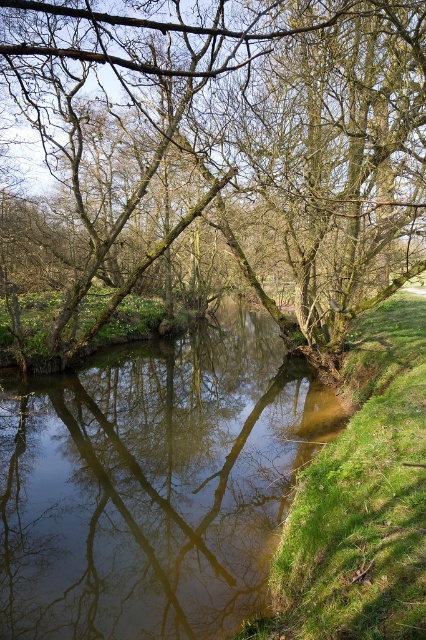
Question: Is smooth bark tree at center further to camera compared to clear water at center?

Choices:
 (A) no
 (B) yes

Answer: (A)

Question: Is smooth bark tree at center positioned behind clear water at center?

Choices:
 (A) yes
 (B) no

Answer: (B)

Question: Which of the following is the farthest from the observer?

Choices:
 (A) smooth bark tree at center
 (B) clear water at center

Answer: (B)

Question: Among these objects, which one is nearest to the camera?

Choices:
 (A) clear water at center
 (B) smooth bark tree at center

Answer: (B)

Question: Considering the relative positions of smooth bark tree at center and clear water at center in the image provided, where is smooth bark tree at center located with respect to clear water at center?

Choices:
 (A) below
 (B) above

Answer: (B)

Question: Which point appears closest to the camera in this image?

Choices:
 (A) (406, 172)
 (B) (17, 564)

Answer: (B)